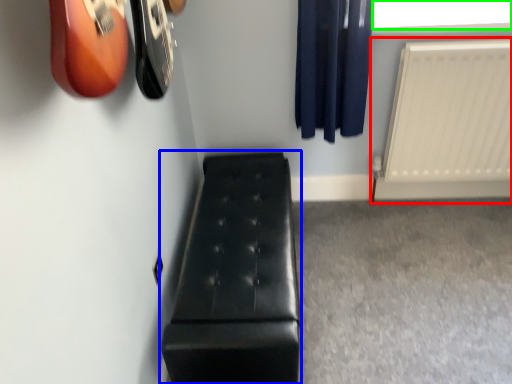
Question: Based on their relative distances, which object is farther from radiator (highlighted by a red box)? Choose from furniture (highlighted by a blue box) and window screen (highlighted by a green box).

Choices:
 (A) furniture
 (B) window screen

Answer: (A)